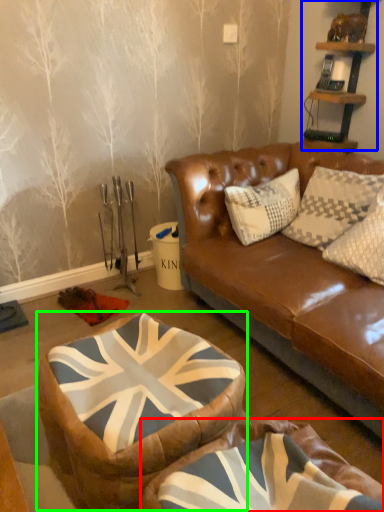
Question: Which object is positioned closest to bean bag chair (highlighted by a red box)? Select from shelf (highlighted by a blue box) and bean bag chair (highlighted by a green box).

Choices:
 (A) shelf
 (B) bean bag chair

Answer: (B)